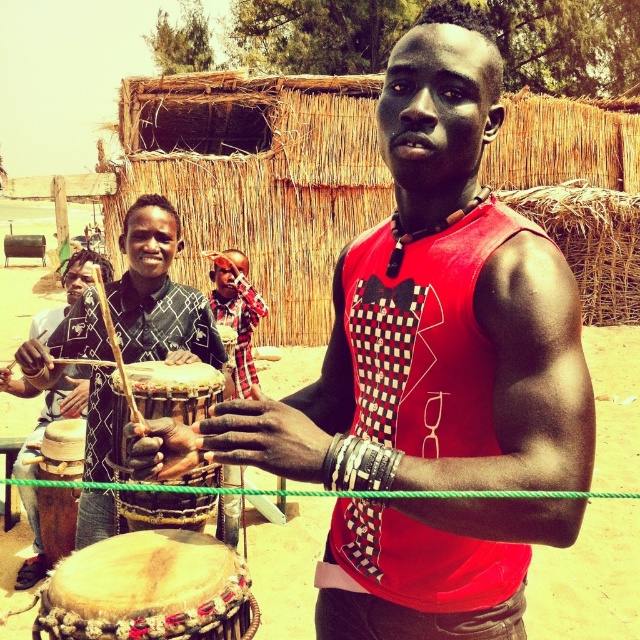
Is red matte vest at center further to the viewer compared to leather-like drum at lower left?

No, it is in front of leather-like drum at lower left.

Can you confirm if red matte vest at center is thinner than leather-like drum at lower left?

No, red matte vest at center is not thinner than leather-like drum at lower left.

Locate an element on the screen. This screenshot has width=640, height=640. red matte vest at center is located at coordinates (426, 317).

Does matte black drum at left appear under leather-like drum at lower left?

No.

Is matte black drum at left to the right of leather-like drum at lower left from the viewer's perspective?

Incorrect, matte black drum at left is not on the right side of leather-like drum at lower left.

You are a GUI agent. You are given a task and a screenshot of the screen. Output one action in this format:
    pyautogui.click(x=<x>, y=<y>)
    Task: Click on the matte black drum at left
    
    Given the screenshot: What is the action you would take?
    pyautogui.click(x=157, y=292)

Does brown sandy dirt at center have a greater height compared to leather-like drum at lower left?

Correct, brown sandy dirt at center is much taller as leather-like drum at lower left.

Is brown sandy dirt at center further to camera compared to leather-like drum at lower left?

Yes, it is.

Between point (595, 548) and point (163, 620), which one is positioned in front?

Positioned in front is point (163, 620).

Locate an element on the screen. brown sandy dirt at center is located at coordinates (x=588, y=579).